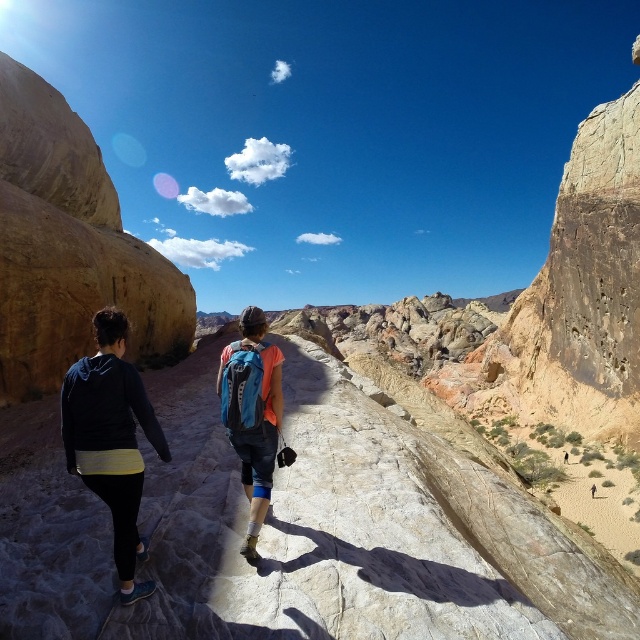
You are a hiker who needs to place a 1.5 meter long tent between the dark blue fleece at center and the blue fabric backpack at center. Is there enough space between them to fit the tent?

The dark blue fleece at center and blue fabric backpack at center are 14.36 meters apart, so yes, there is enough space to fit a 1.5 meter long tent between them since the distance is greater than the tent length.

You are a hiker trying to locate your lost backpack in the desert. You see two backpacks in the distance, a matte blue backpack at center and a blue fabric backpack at center. Which backpack is farther away from you?

The blue fabric backpack at center is farther away because the distance between the matte blue backpack at center and blue fabric backpack at center is 7.94 meters, so the blue fabric backpack at center is farther from the observer.